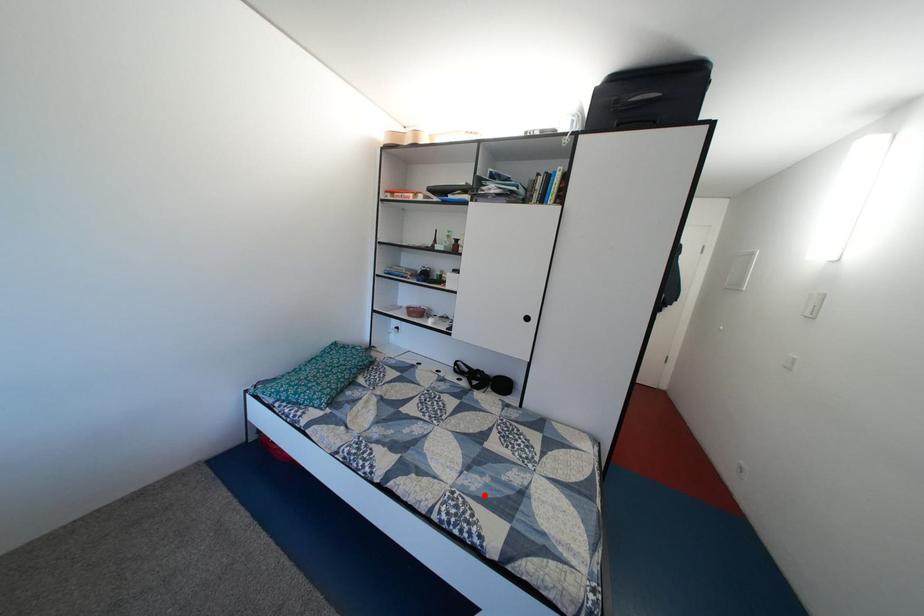
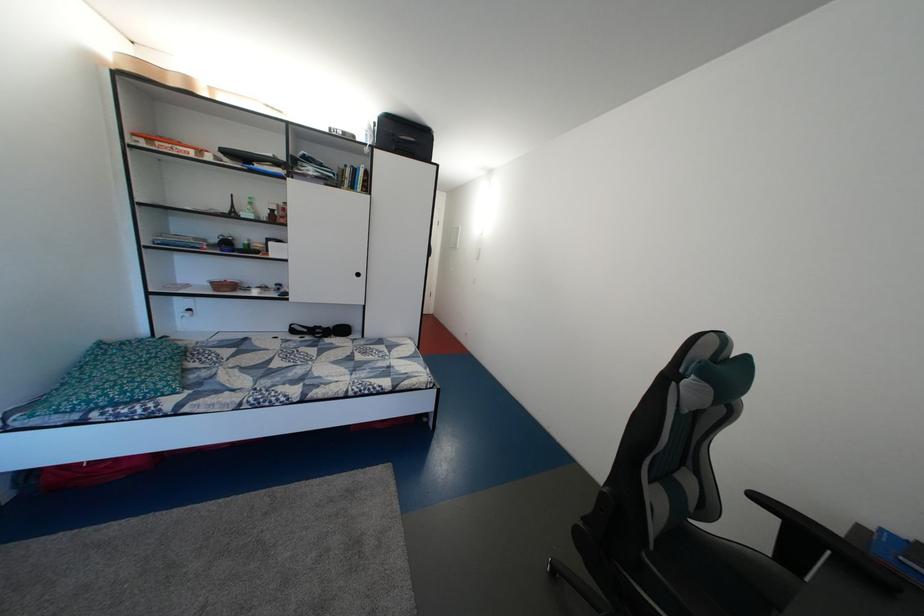
Where in the second image is the point corresponding to the highlighted location from the first image?

(373, 382)